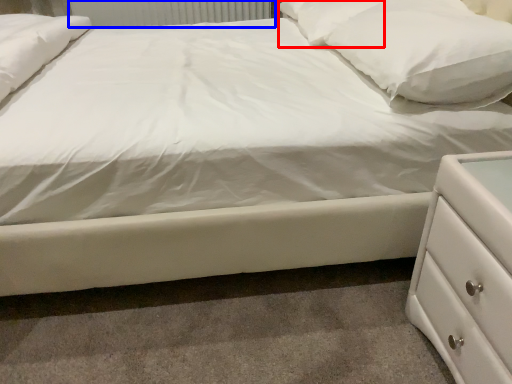
Question: Which object is further to the camera taking this photo, pillow (highlighted by a red box) or radiator (highlighted by a blue box)?

Choices:
 (A) pillow
 (B) radiator

Answer: (B)